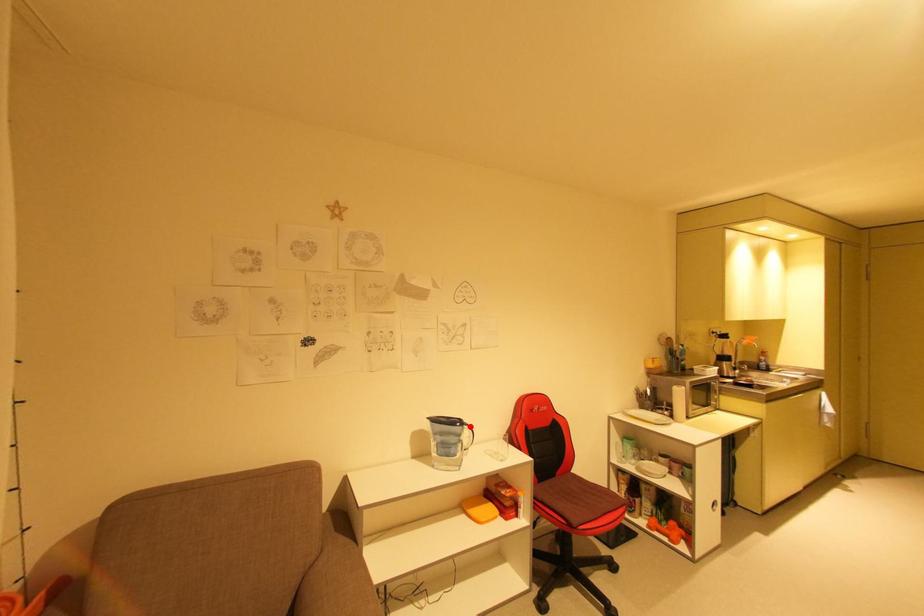
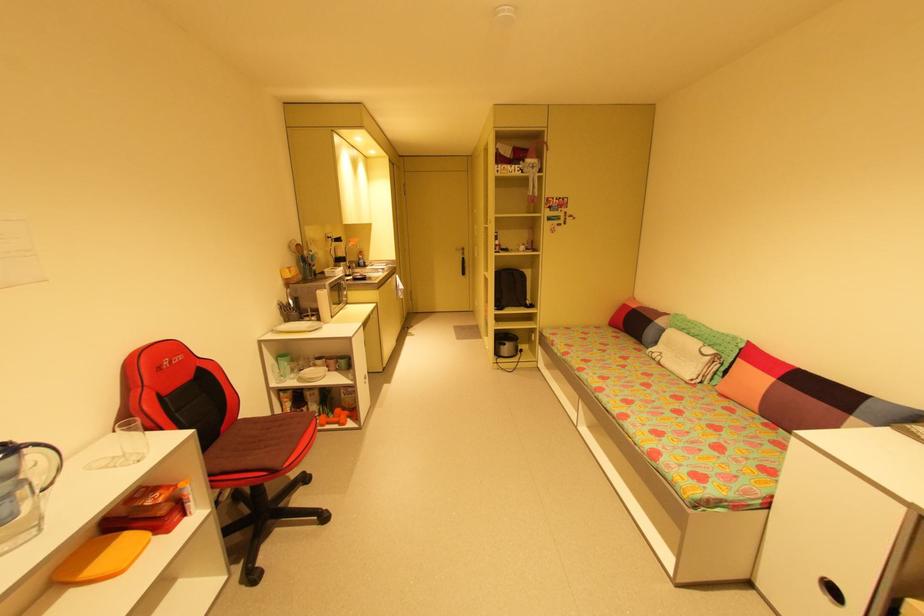
Locate, in the second image, the point that corresponds to the highlighted location in the first image.

(30, 450)